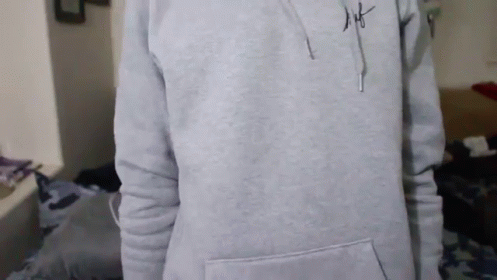
Locate an element on the screen. white cord on grey pillow on the left is located at coordinates (119, 221).